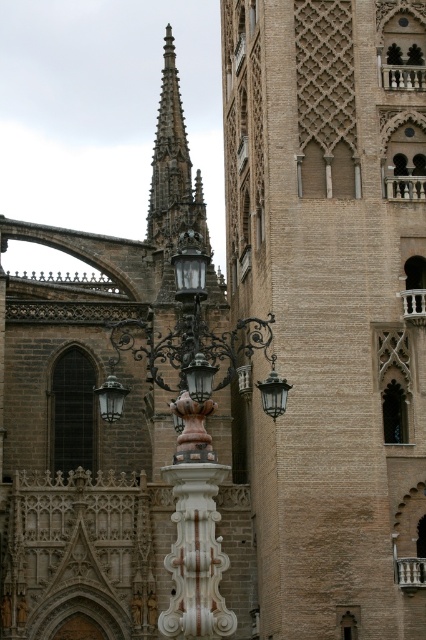
Which is below, white marble column at center or smooth stone spire at center?

Positioned lower is white marble column at center.

Is point (184, 468) behind point (206, 234)?

No, (184, 468) is closer to viewer.

Identify the location of white marble column at center. The height and width of the screenshot is (640, 426). (195, 556).

Is brown brick tower at center positioned at the back of smooth stone spire at center?

No, brown brick tower at center is in front of smooth stone spire at center.

Consider the image. Which is more to the left, brown brick tower at center or smooth stone spire at center?

Positioned to the left is smooth stone spire at center.

Which is behind, point (386, 433) or point (190, 186)?

Positioned behind is point (190, 186).

Where is `brown brick tower at center`? Image resolution: width=426 pixels, height=640 pixels. brown brick tower at center is located at coordinates (331, 305).

Who is more distant from viewer, (368, 589) or (101, 410)?

Positioned behind is point (368, 589).

Which is in front, point (270, 160) or point (109, 403)?

Positioned in front is point (109, 403).

Between point (353, 582) and point (120, 413), which one is positioned behind?

Positioned behind is point (353, 582).

Locate an element on the screen. The width and height of the screenshot is (426, 640). brown brick tower at center is located at coordinates (331, 305).